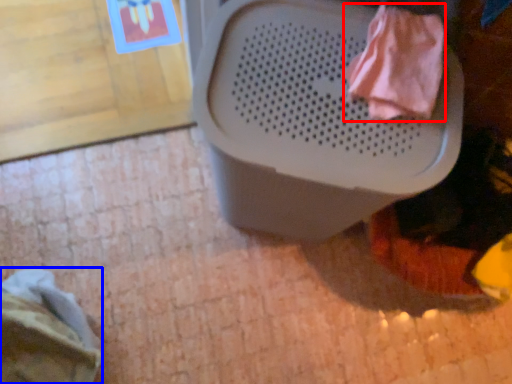
Question: Which of the following is the closest to the observer, clothing (highlighted by a red box) or clothing (highlighted by a blue box)?

Choices:
 (A) clothing
 (B) clothing

Answer: (A)